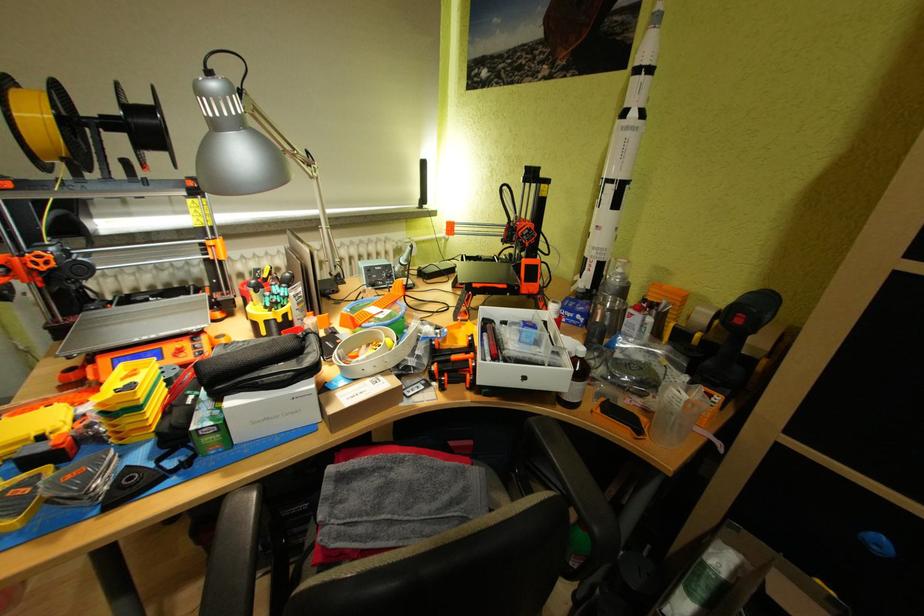
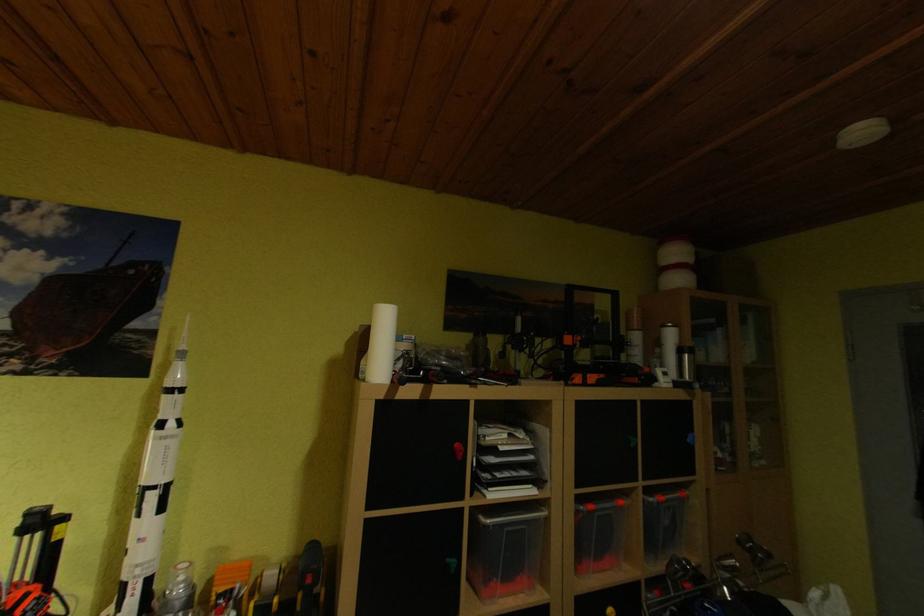
Question: Based on the continuous images, in which direction is the camera rotating? Reply with the corresponding letter.

Choices:
 (A) Left
 (B) Right
 (C) Up
 (D) Down

Answer: (B)